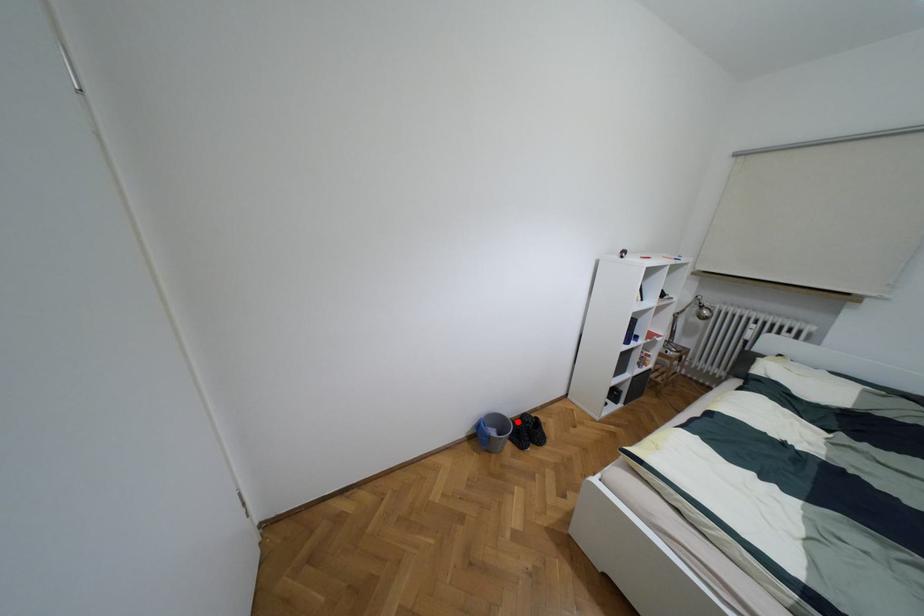
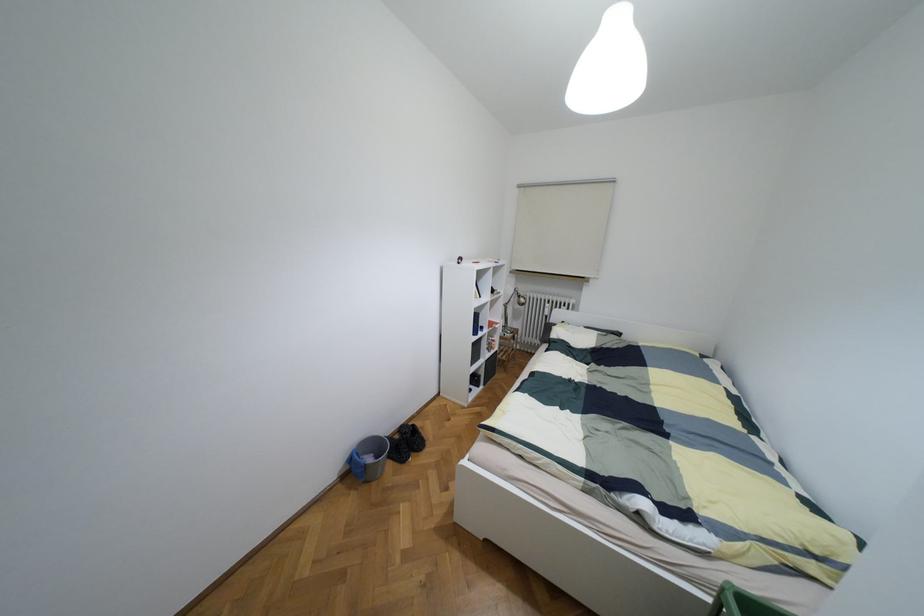
Question: I am providing you with two images of the same scene from different viewpoints. In image1, a red point is highlighted. Considering the same 3D point in image2, which of the following is correct?

Choices:
 (A) It is closer
 (B) It is farther

Answer: (A)